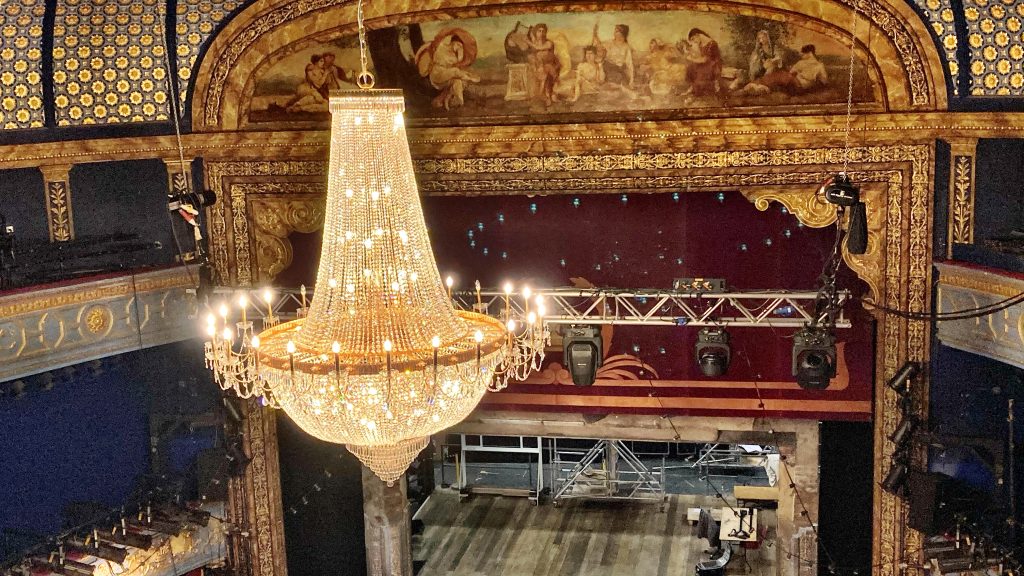
I want to click on wires, so click(x=889, y=314), click(x=986, y=308), click(x=169, y=73).